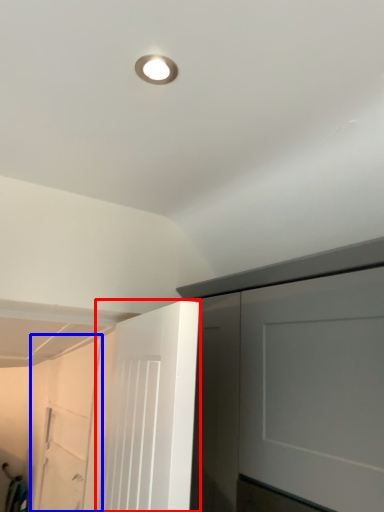
Question: Which of the following is the closest to the observer, door (highlighted by a red box) or garage door (highlighted by a blue box)?

Choices:
 (A) door
 (B) garage door

Answer: (A)